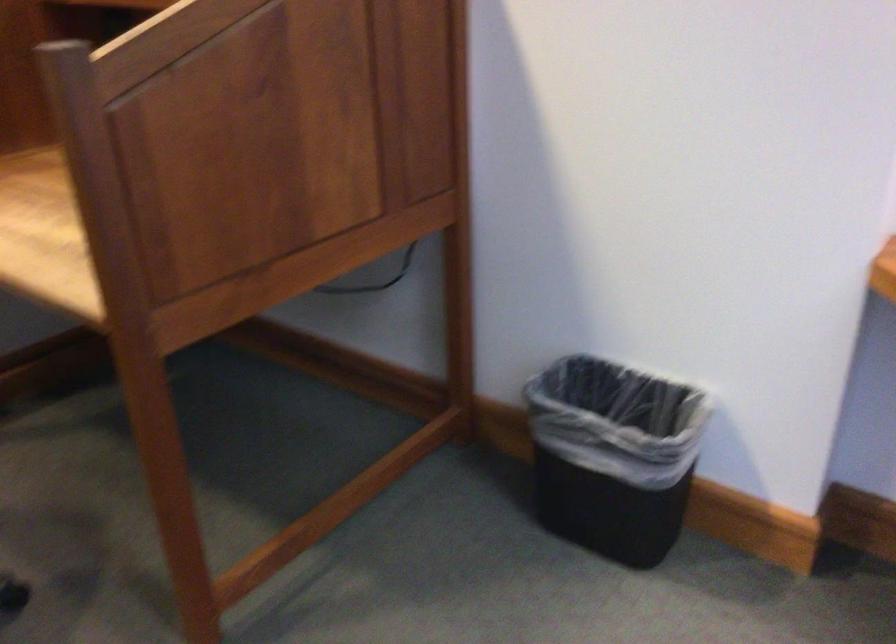
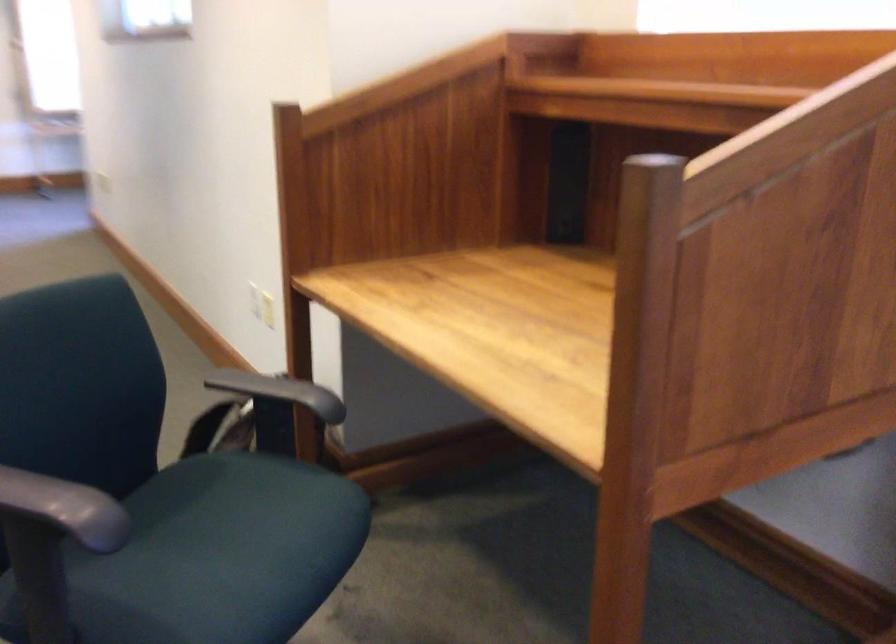
Question: How did the camera likely rotate?

Choices:
 (A) Left
 (B) Right
 (C) Up
 (D) Down

Answer: (A)